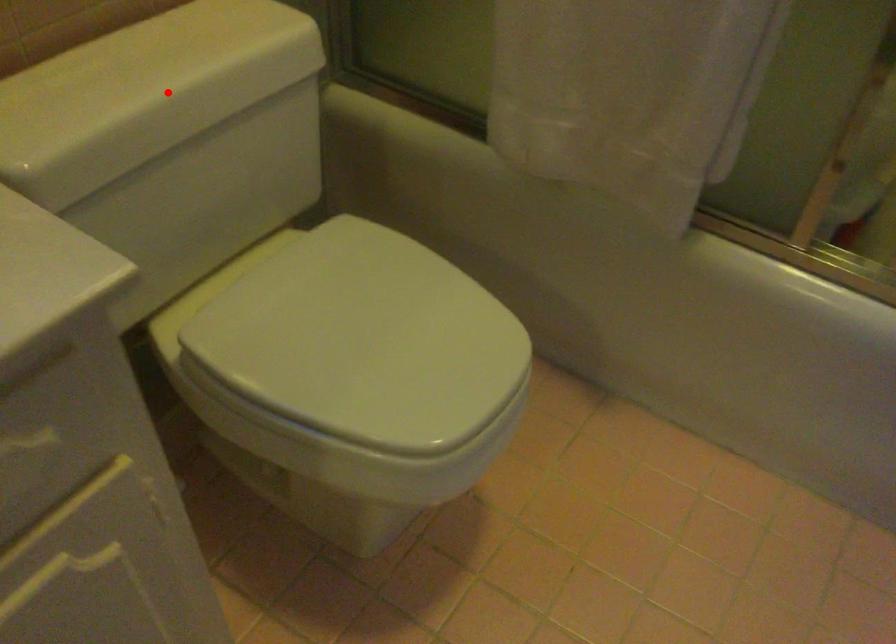
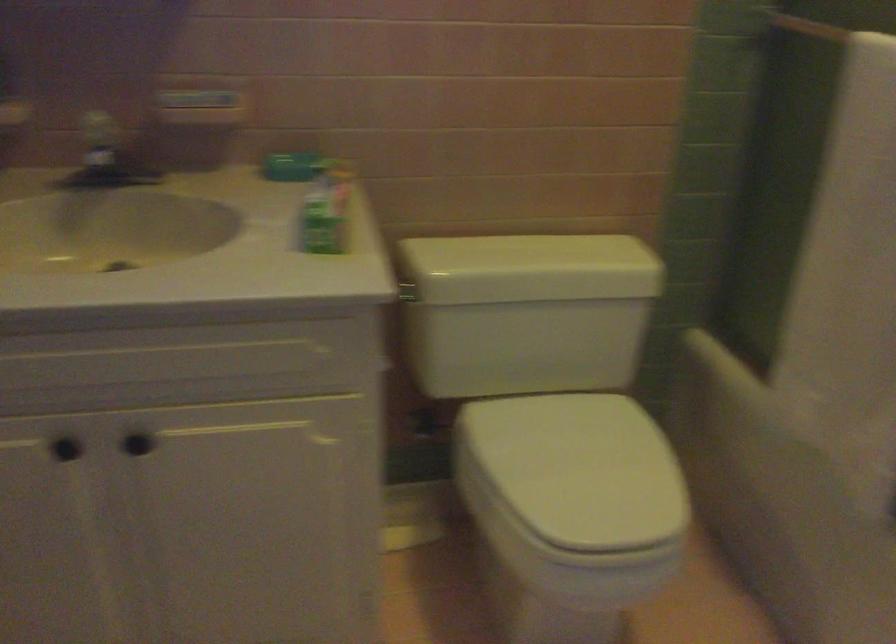
Question: I am providing you with two images of the same scene from different viewpoints. Given a red point in image1, look at the same physical point in image2. Is it:

Choices:
 (A) Closer to the viewpoint
 (B) Farther from the viewpoint

Answer: (B)